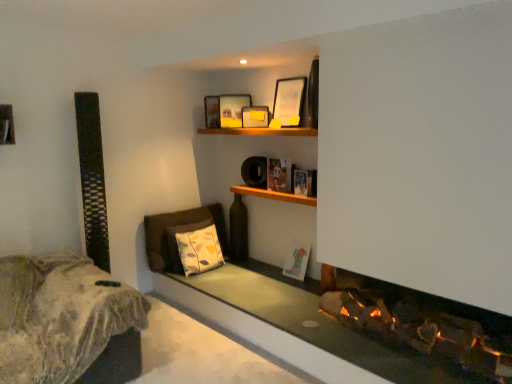
Question: Should I look upward or downward to see matte wooden picture frame at upper center, the 4th picture frame in the bottom-to-top sequence?

Choices:
 (A) up
 (B) down

Answer: (A)

Question: Is wooden shelf at center completely or partially outside of matte wooden picture frame at upper center, which is the first picture frame in top-to-bottom order?

Choices:
 (A) yes
 (B) no

Answer: (A)

Question: Can you confirm if wooden shelf at center is wider than matte wooden picture frame at upper center, which is the first picture frame in top-to-bottom order?

Choices:
 (A) no
 (B) yes

Answer: (B)

Question: Is wooden shelf at center facing towards matte wooden picture frame at upper center, the 4th picture frame in the bottom-to-top sequence?

Choices:
 (A) no
 (B) yes

Answer: (A)

Question: From a real-world perspective, is wooden shelf at center located beneath matte wooden picture frame at upper center, which is the first picture frame in top-to-bottom order?

Choices:
 (A) yes
 (B) no

Answer: (A)

Question: Does wooden shelf at center appear on the left side of matte wooden picture frame at upper center, the 4th picture frame in the bottom-to-top sequence?

Choices:
 (A) no
 (B) yes

Answer: (B)

Question: Is wooden shelf at center smaller than matte wooden picture frame at upper center, which is the first picture frame in top-to-bottom order?

Choices:
 (A) yes
 (B) no

Answer: (A)

Question: Is wooden shelf at upper center touching matte wooden picture frame at upper center, which is the first picture frame in top-to-bottom order?

Choices:
 (A) no
 (B) yes

Answer: (A)

Question: Does wooden shelf at upper center lie behind matte wooden picture frame at upper center, which is the first picture frame in top-to-bottom order?

Choices:
 (A) no
 (B) yes

Answer: (A)

Question: Is wooden shelf at upper center at the left side of matte wooden picture frame at upper center, which is the first picture frame in top-to-bottom order?

Choices:
 (A) yes
 (B) no

Answer: (A)

Question: Is wooden shelf at upper center outside of matte wooden picture frame at upper center, the 4th picture frame in the bottom-to-top sequence?

Choices:
 (A) no
 (B) yes

Answer: (B)

Question: From the image's perspective, is wooden shelf at upper center beneath matte wooden picture frame at upper center, the 4th picture frame in the bottom-to-top sequence?

Choices:
 (A) yes
 (B) no

Answer: (A)

Question: Considering the relative sizes of wooden shelf at upper center and matte wooden picture frame at upper center, the 4th picture frame in the bottom-to-top sequence, in the image provided, is wooden shelf at upper center thinner than matte wooden picture frame at upper center, the 4th picture frame in the bottom-to-top sequence,?

Choices:
 (A) no
 (B) yes

Answer: (A)

Question: Can you confirm if matte white picture frame at lower center, which is counted as the fourth picture frame, starting from the top, is thinner than wooden shelf at center?

Choices:
 (A) yes
 (B) no

Answer: (A)